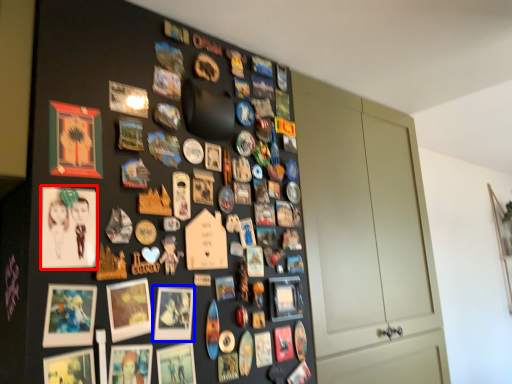
Question: Which object is further to the camera taking this photo, picture frame (highlighted by a red box) or picture frame (highlighted by a blue box)?

Choices:
 (A) picture frame
 (B) picture frame

Answer: (B)